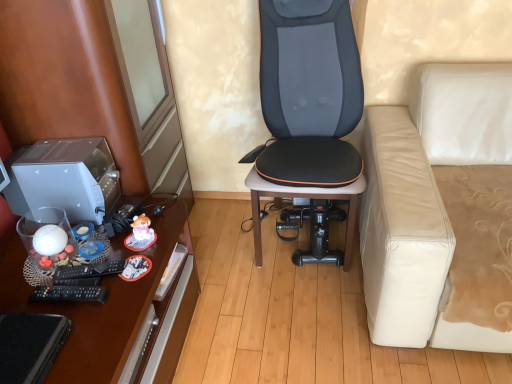
Question: From the image's perspective, would you say black leather chair at center is positioned over brown wooden desk at left?

Choices:
 (A) no
 (B) yes

Answer: (B)

Question: Could brown wooden desk at left be considered to be inside black leather chair at center?

Choices:
 (A) yes
 (B) no

Answer: (B)

Question: Does black leather chair at center have a smaller size compared to brown wooden desk at left?

Choices:
 (A) yes
 (B) no

Answer: (A)

Question: Is black leather chair at center bigger than brown wooden desk at left?

Choices:
 (A) no
 (B) yes

Answer: (A)

Question: Is the depth of black leather chair at center greater than that of brown wooden desk at left?

Choices:
 (A) yes
 (B) no

Answer: (A)

Question: From the image's perspective, is black leather chair at center above or below brown wood dresser at left?

Choices:
 (A) above
 (B) below

Answer: (B)

Question: Considering their positions, is black leather chair at center located in front of or behind brown wood dresser at left?

Choices:
 (A) behind
 (B) front

Answer: (A)

Question: Does point (309, 76) appear closer or farther from the camera than point (108, 302)?

Choices:
 (A) closer
 (B) farther

Answer: (B)

Question: Looking at their shapes, would you say black leather chair at center is wider or thinner than brown wood dresser at left?

Choices:
 (A) thin
 (B) wide

Answer: (A)

Question: Considering the positions of brown wood dresser at left and brown wooden desk at left in the image, is brown wood dresser at left bigger or smaller than brown wooden desk at left?

Choices:
 (A) small
 (B) big

Answer: (B)

Question: Relative to brown wooden desk at left, is brown wood dresser at left in front or behind?

Choices:
 (A) front
 (B) behind

Answer: (B)

Question: Is brown wood dresser at left inside or outside of brown wooden desk at left?

Choices:
 (A) outside
 (B) inside

Answer: (A)

Question: From the image's perspective, is brown wood dresser at left located above or below brown wooden desk at left?

Choices:
 (A) below
 (B) above

Answer: (B)

Question: From their relative heights in the image, would you say satin silver desktop at left is taller or shorter than brown wood dresser at left?

Choices:
 (A) short
 (B) tall

Answer: (A)

Question: In terms of width, does satin silver desktop at left look wider or thinner when compared to brown wood dresser at left?

Choices:
 (A) thin
 (B) wide

Answer: (A)